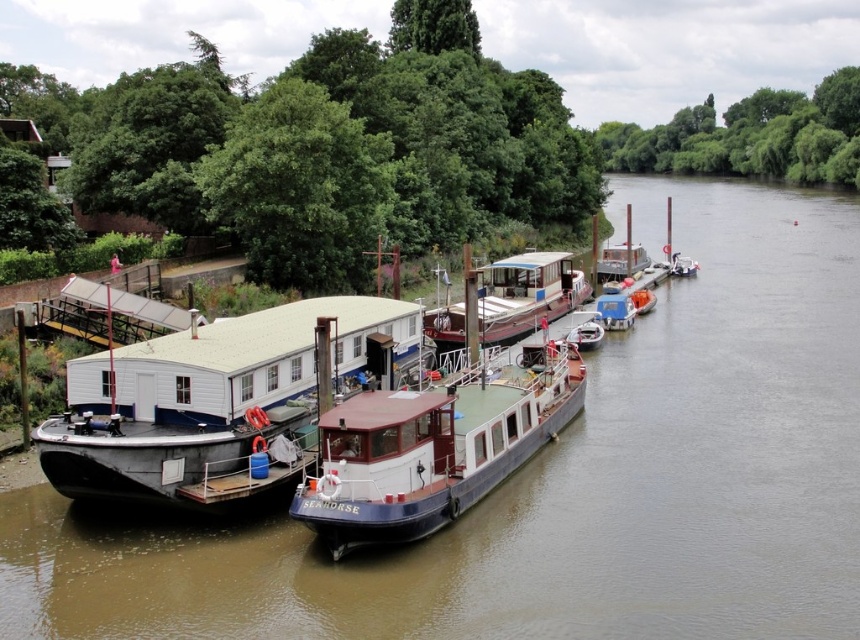
Does white matte houseboat at center have a greater width compared to blue plastic boat at center?

Indeed, white matte houseboat at center has a greater width compared to blue plastic boat at center.

Who is lower down, white matte houseboat at center or blue plastic boat at center?

white matte houseboat at center is lower down.

The height and width of the screenshot is (640, 860). I want to click on white matte houseboat at center, so click(x=207, y=403).

From the picture: Does dark blue polished wood boat at center have a lesser height compared to white plastic boat at center?

In fact, dark blue polished wood boat at center may be taller than white plastic boat at center.

Where is `dark blue polished wood boat at center`? The image size is (860, 640). dark blue polished wood boat at center is located at coordinates (434, 448).

I want to click on dark blue polished wood boat at center, so click(434, 448).

Is dark blue polished wood boat at center closer to camera compared to metallic gray barge at center?

That is True.

Does point (381, 438) lie behind point (642, 266)?

No, (381, 438) is closer to viewer.

The width and height of the screenshot is (860, 640). Find the location of `dark blue polished wood boat at center`. dark blue polished wood boat at center is located at coordinates (434, 448).